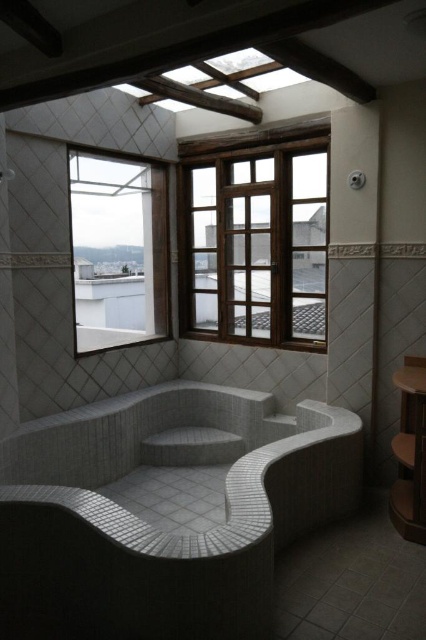
Which is behind, point (161, 416) or point (85, 211)?

The point (85, 211) is behind.

Which is more to the right, white mosaic tile jacuzzi at lower center or clear glass window at upper left?

From the viewer's perspective, white mosaic tile jacuzzi at lower center appears more on the right side.

Find the location of a particular element. This screenshot has height=640, width=426. white mosaic tile jacuzzi at lower center is located at coordinates (164, 512).

Where is `white mosaic tile jacuzzi at lower center`? This screenshot has width=426, height=640. white mosaic tile jacuzzi at lower center is located at coordinates (164, 512).

Which is above, white mosaic tile jacuzzi at lower center or wooden-framed window at center?

Positioned higher is wooden-framed window at center.

This screenshot has height=640, width=426. What do you see at coordinates (164, 512) in the screenshot?
I see `white mosaic tile jacuzzi at lower center` at bounding box center [164, 512].

This screenshot has height=640, width=426. I want to click on white mosaic tile jacuzzi at lower center, so click(164, 512).

Which is more to the left, wooden-framed window at center or clear glass window at upper left?

clear glass window at upper left

Is wooden-framed window at center smaller than clear glass window at upper left?

Actually, wooden-framed window at center might be larger than clear glass window at upper left.

You are a GUI agent. You are given a task and a screenshot of the screen. Output one action in this format:
    pyautogui.click(x=<x>, y=<y>)
    Task: Click on the wooden-framed window at center
    The height and width of the screenshot is (640, 426).
    Given the screenshot: What is the action you would take?
    pyautogui.click(x=256, y=240)